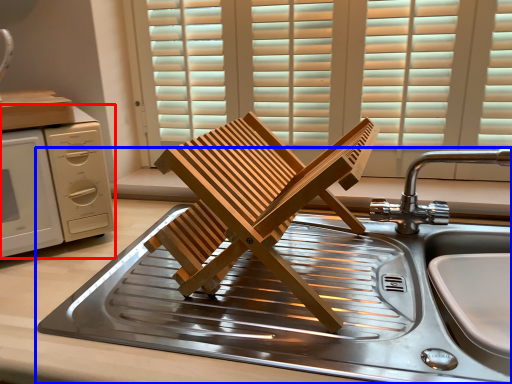
Question: Which object appears closest to the camera in this image, home appliance (highlighted by a red box) or sink (highlighted by a blue box)?

Choices:
 (A) home appliance
 (B) sink

Answer: (B)